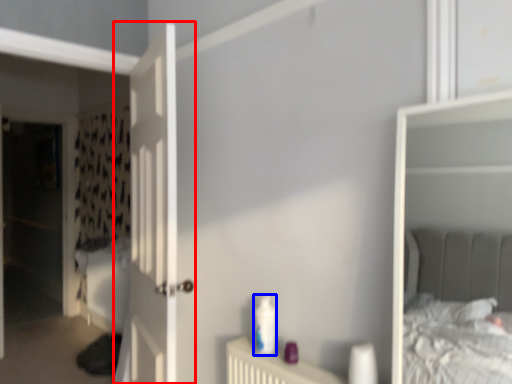
Question: Which object is closer to the camera taking this photo, door (highlighted by a red box) or toiletry (highlighted by a blue box)?

Choices:
 (A) door
 (B) toiletry

Answer: (B)